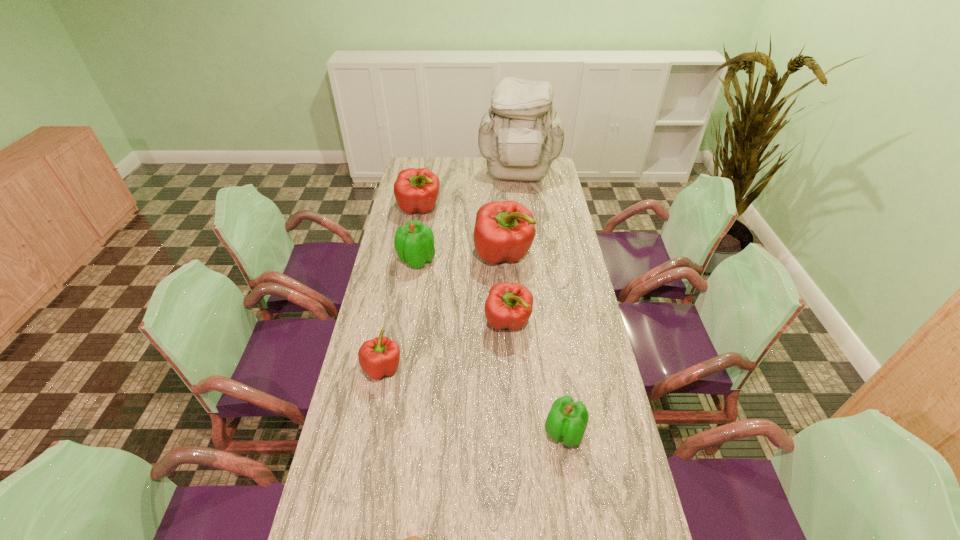
Identify the location of free space between the second nearest bell pepper and the second biggest pink bell pepper. The image size is (960, 540). (401, 288).

At what (x,y) coordinates should I click in order to perform the action: click on vacant space that's between the smallest pink bell pepper and the second biggest pink bell pepper. Please return your answer as a coordinate pair (x, y). This screenshot has height=540, width=960. Looking at the image, I should click on (401, 288).

Find the location of a particular element. unoccupied position between the biggest pink bell pepper and the second nearest object is located at coordinates pos(534,344).

You are a GUI agent. You are given a task and a screenshot of the screen. Output one action in this format:
    pyautogui.click(x=<x>, y=<y>)
    Task: Click on the free area in between the second nearest object and the seventh shortest object
    The width and height of the screenshot is (960, 540).
    Given the screenshot: What is the action you would take?
    pyautogui.click(x=534, y=344)

Point out which object is positioned as the nearest to the second farthest pink bell pepper. Please provide its 2D coordinates. Your answer should be formatted as a tuple, i.e. [(x, y)], where the tuple contains the x and y coordinates of a point satisfying the conditions above.

[(414, 242)]

Identify the location of the sixth closest object relative to the bigger green bell pepper. This screenshot has height=540, width=960. (567, 420).

Choose which bell pepper is the second nearest neighbor to the farthest pink bell pepper. Please provide its 2D coordinates. Your answer should be formatted as a tuple, i.e. [(x, y)], where the tuple contains the x and y coordinates of a point satisfying the conditions above.

[(504, 231)]

Where is `bell pepper that stands as the fourth closest to the farther green bell pepper`? Image resolution: width=960 pixels, height=540 pixels. bell pepper that stands as the fourth closest to the farther green bell pepper is located at coordinates (380, 356).

You are a GUI agent. You are given a task and a screenshot of the screen. Output one action in this format:
    pyautogui.click(x=<x>, y=<y>)
    Task: Click on the pink bell pepper that is the closest one to the nearest object
    This screenshot has width=960, height=540.
    Given the screenshot: What is the action you would take?
    pyautogui.click(x=380, y=356)

Choose which pink bell pepper is the third nearest neighbor to the fifth farthest bell pepper. Please provide its 2D coordinates. Your answer should be formatted as a tuple, i.e. [(x, y)], where the tuple contains the x and y coordinates of a point satisfying the conditions above.

[(416, 190)]